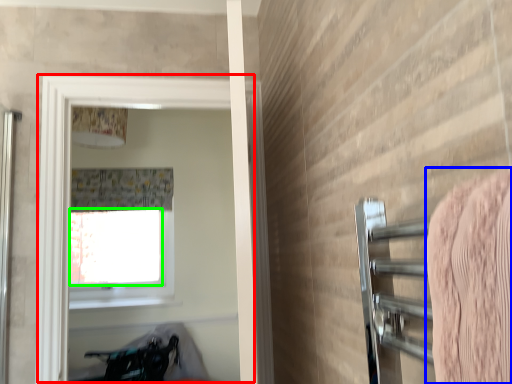
Question: Which object is the farthest from screen door (highlighted by a red box)? Choose among these: bath towel (highlighted by a blue box) or window screen (highlighted by a green box).

Choices:
 (A) bath towel
 (B) window screen

Answer: (A)